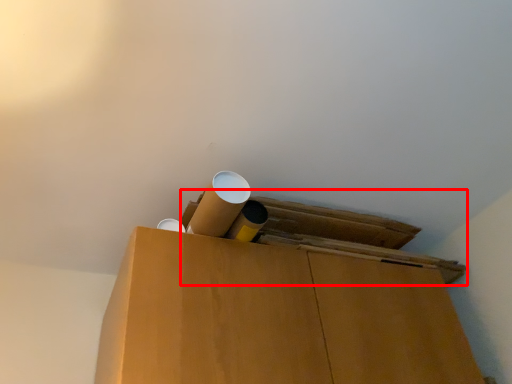
Question: Where is wide (annotated by the red box) located in relation to wide in the image?

Choices:
 (A) left
 (B) right

Answer: (B)